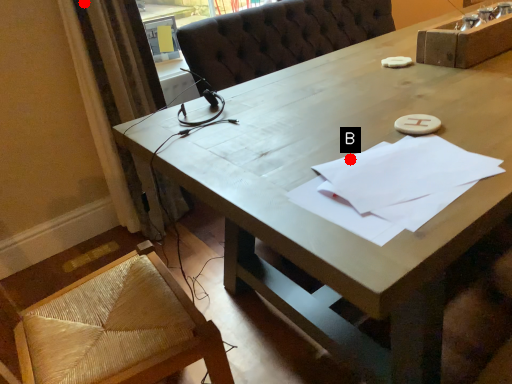
Question: Two points are circled on the image, labeled by A and B beside each circle. Among these points, which one is farthest from the camera?

Choices:
 (A) A is further
 (B) B is further

Answer: (A)